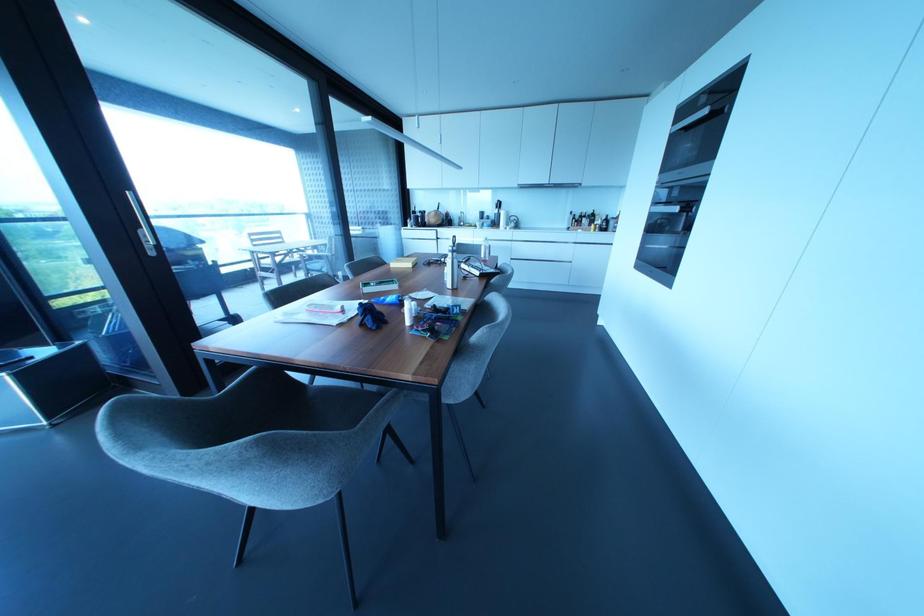
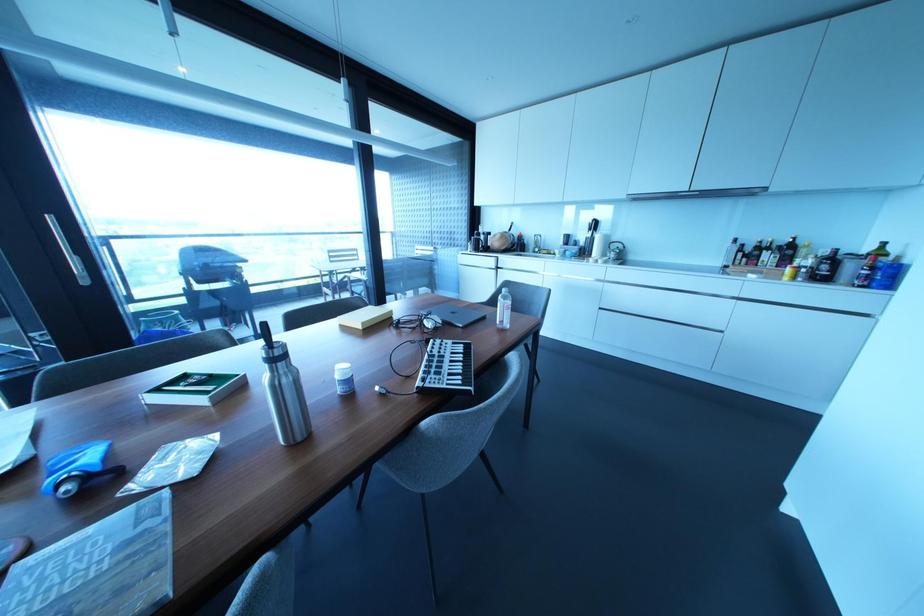
Locate, in the second image, the point that corresponds to [151,253] in the first image.

(83, 281)